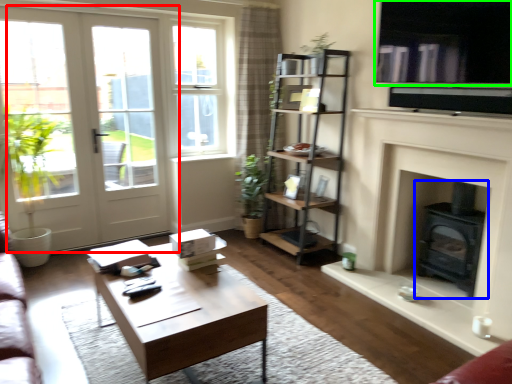
Question: Based on their relative distances, which object is farther from door (highlighted by a red box)? Choose from wood burning stove (highlighted by a blue box) and window screen (highlighted by a green box).

Choices:
 (A) wood burning stove
 (B) window screen

Answer: (A)